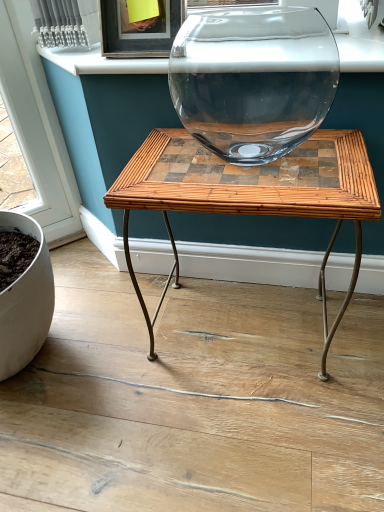
Locate an element on the screen. vacant region to the left of bamboo/rattan table at center is located at coordinates coord(118,360).